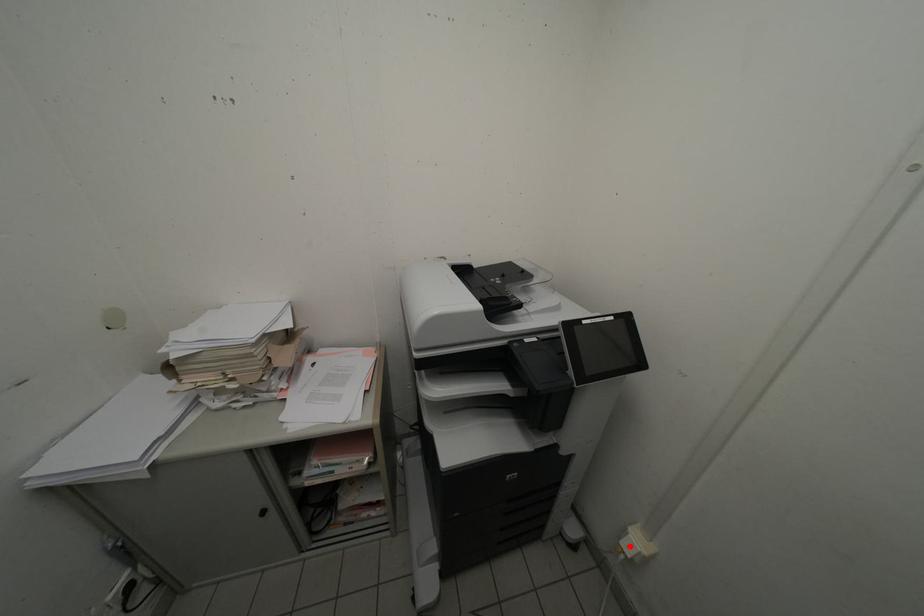
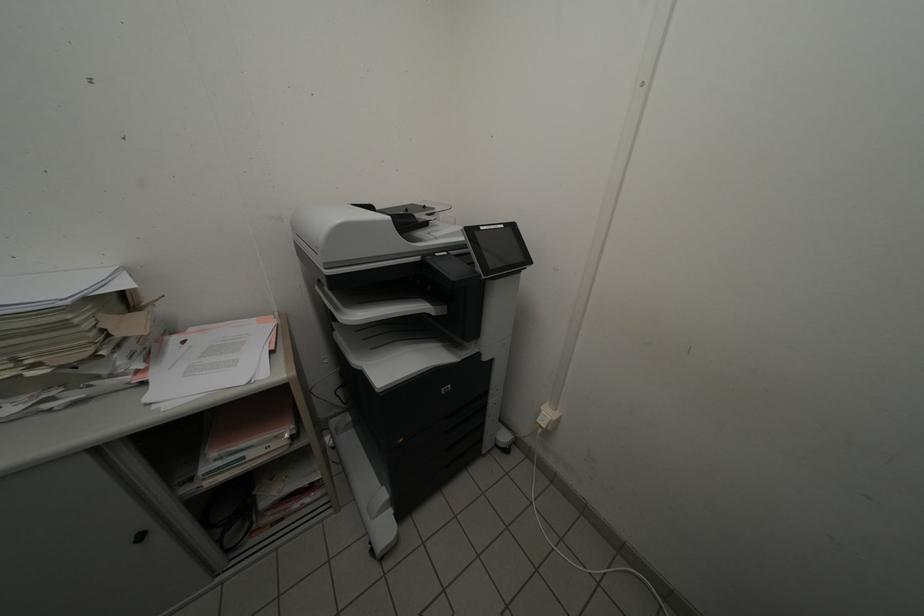
Find the pixel in the second image that matches the highlighted location in the first image.

(546, 424)